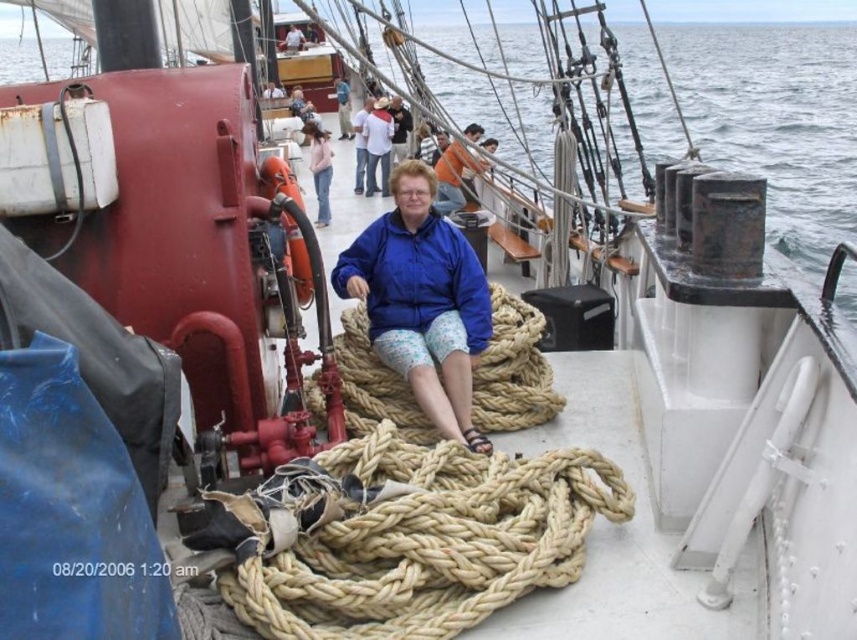
Question: Can you confirm if light pink fabric at upper center is positioned to the left of blue fabric jacket at center?

Choices:
 (A) yes
 (B) no

Answer: (B)

Question: Which point is closer to the camera?

Choices:
 (A) orange fabric shirt at upper center
 (B) light pink fabric at upper center
 (C) natural tan rope at lower center
 (D) white cotton shirt at center

Answer: (C)

Question: Can you confirm if blue matte jacket at center is smaller than orange fabric shirt at upper center?

Choices:
 (A) no
 (B) yes

Answer: (B)

Question: Based on their relative distances, which object is nearer to the natural tan rope at center?

Choices:
 (A) blue fabric jacket at center
 (B) orange fabric shirt at upper center

Answer: (B)

Question: Is natural tan rope at lower center behind light pink fabric at upper center?

Choices:
 (A) yes
 (B) no

Answer: (B)

Question: Estimate the real-world distances between objects in this image. Which object is closer to the natural tan rope at lower center?

Choices:
 (A) blue matte jacket at center
 (B) light pink fabric at upper center
 (C) white cotton shirt at center

Answer: (A)